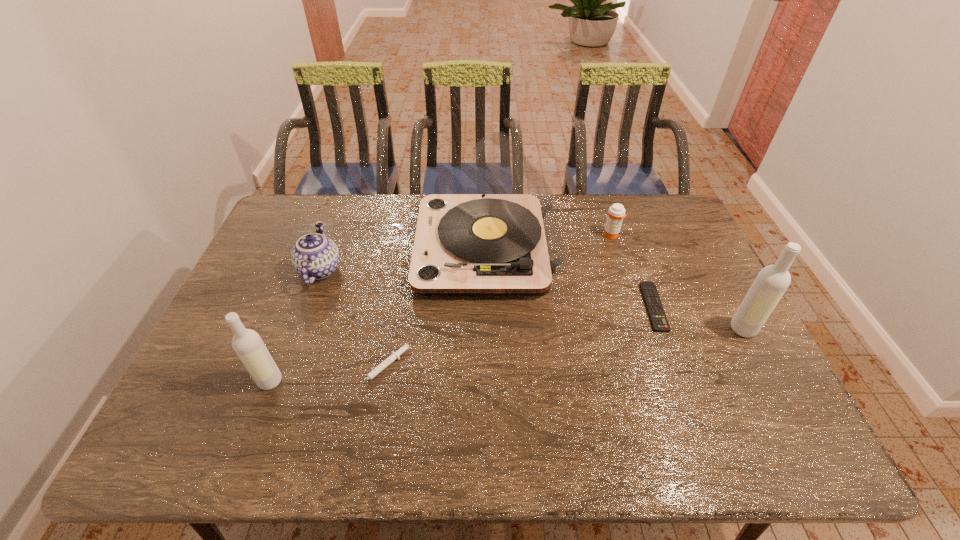
I want to click on vodka positioned at the near edge, so click(x=248, y=345).

The height and width of the screenshot is (540, 960). What are the coordinates of `syringe that is at the near edge` in the screenshot? It's located at (395, 355).

At what (x,y) coordinates should I click in order to perform the action: click on object that is at the left edge. Please return your answer as a coordinate pair (x, y). Looking at the image, I should click on (314, 256).

What are the coordinates of `object that is at the right edge` in the screenshot? It's located at (771, 283).

At what (x,y) coordinates should I click in order to perform the action: click on vacant space at the far edge of the desktop. Please return your answer as a coordinate pair (x, y). Image resolution: width=960 pixels, height=540 pixels. Looking at the image, I should click on (356, 229).

Find the location of a particular element. vacant area at the near edge of the desktop is located at coordinates pyautogui.click(x=431, y=402).

Identify the location of vacant space at the left edge of the desktop. This screenshot has height=540, width=960. (288, 296).

The width and height of the screenshot is (960, 540). Find the location of `blank space at the right edge of the desktop`. blank space at the right edge of the desktop is located at coordinates (743, 364).

In the image, there is a desktop. Identify the location of vacant space at the far left corner. (307, 214).

At what (x,y) coordinates should I click in order to perform the action: click on empty space that is in between the tallest object and the chinaware. Please return your answer as a coordinate pair (x, y). Looking at the image, I should click on (403, 259).